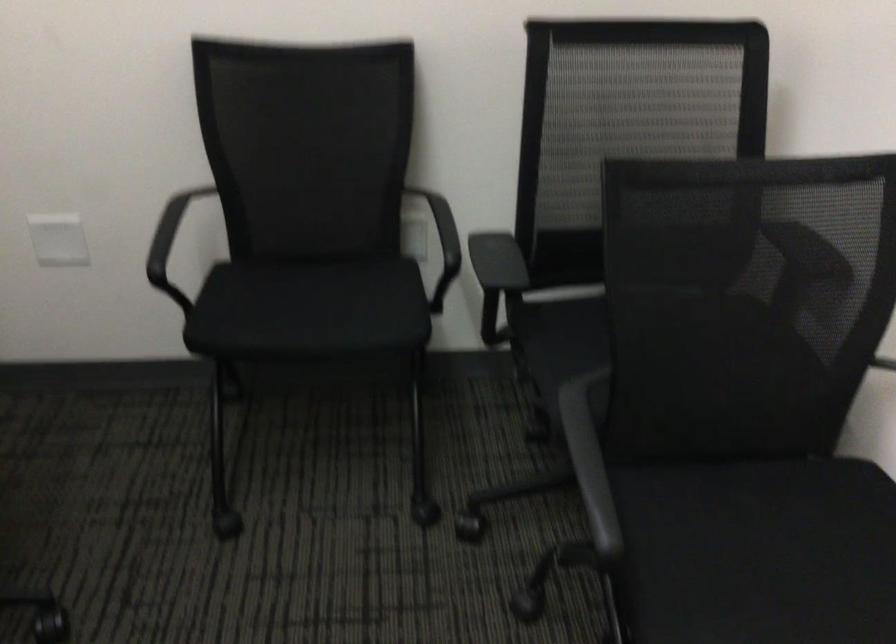
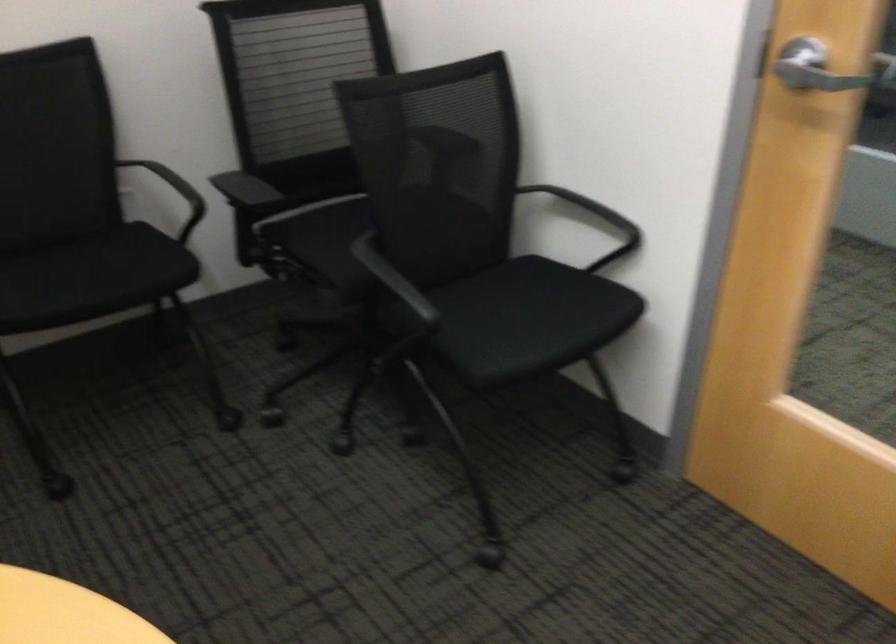
The point at (309, 316) is marked in the first image. Where is the corresponding point in the second image?

(91, 278)